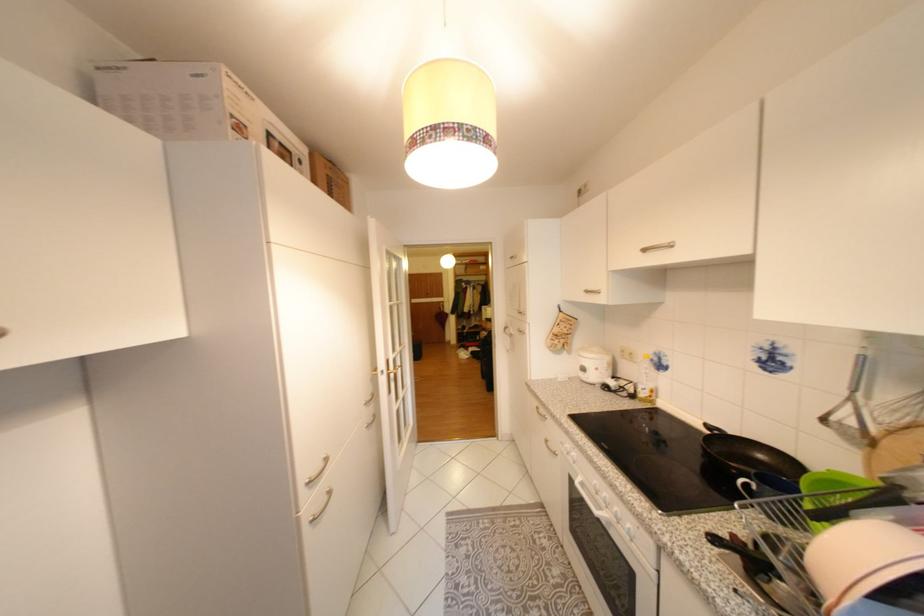
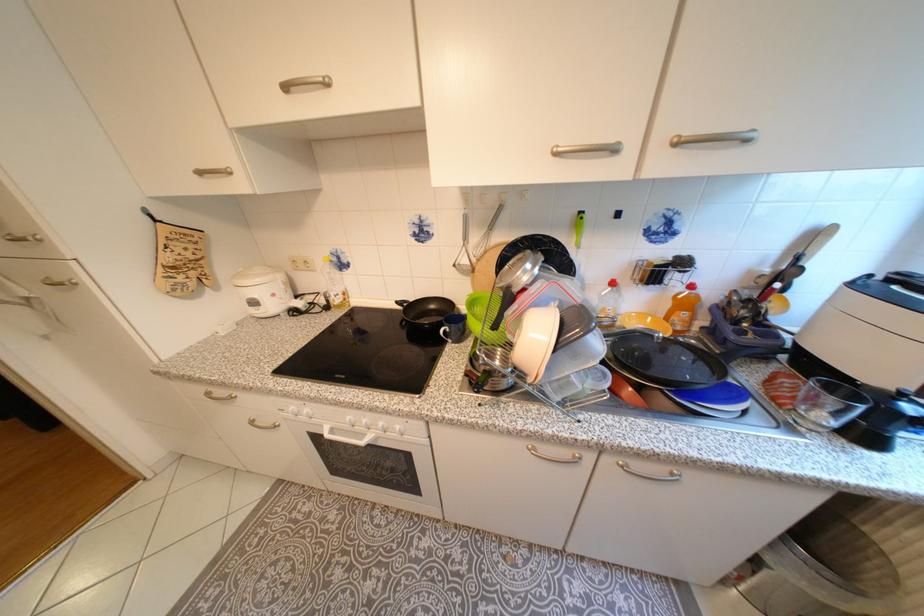
Where in the second image is the point corresponding to [555,442] from the first image?

(261, 423)